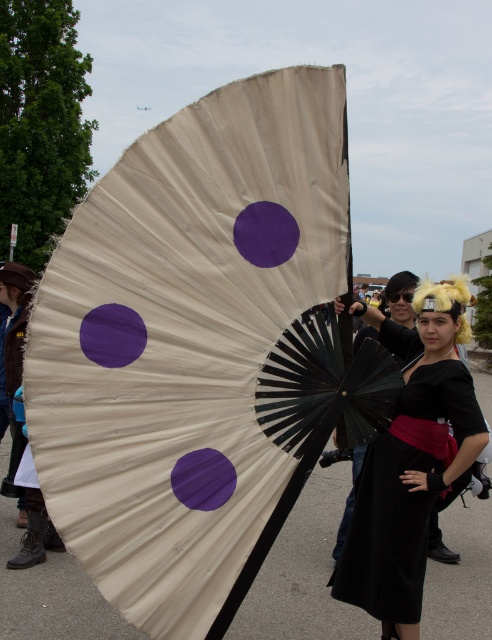
The width and height of the screenshot is (492, 640). What do you see at coordinates (388, 532) in the screenshot?
I see `black velvet dress at center` at bounding box center [388, 532].

Where is `black velvet dress at center`? black velvet dress at center is located at coordinates (388, 532).

Is point (421, 541) closer to camera compared to point (213, 484)?

That is False.

This screenshot has width=492, height=640. In order to click on black velvet dress at center in this screenshot , I will do `click(388, 532)`.

Is the position of purple matte circle at center less distant than that of purple paper at center?

No, purple matte circle at center is further to the viewer.

Is purple matte circle at center positioned behind purple paper at center?

Yes, purple matte circle at center is behind purple paper at center.

You are a GUI agent. You are given a task and a screenshot of the screen. Output one action in this format:
    pyautogui.click(x=<x>, y=<y>)
    Task: Click on the purple matte circle at center
    This screenshot has height=640, width=492.
    Given the screenshot: What is the action you would take?
    pyautogui.click(x=266, y=234)

Is black velvet dress at center to the left of purple matte circle at center from the viewer's perspective?

In fact, black velvet dress at center is to the right of purple matte circle at center.

Can you confirm if black velvet dress at center is wider than purple matte circle at center?

Yes.

Measure the distance between black velvet dress at center and camera.

black velvet dress at center and camera are 2.68 meters apart.

The width and height of the screenshot is (492, 640). Identify the location of black velvet dress at center. tap(388, 532).